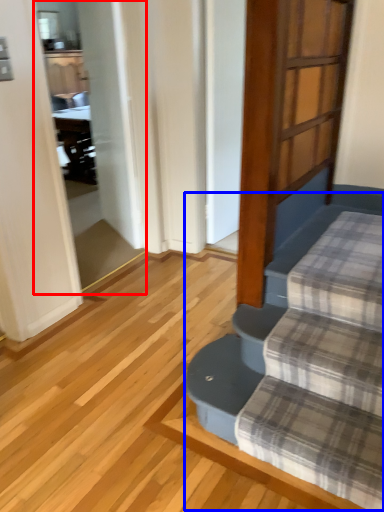
Question: Which point is further to the camera, screen door (highlighted by a red box) or stairwell (highlighted by a blue box)?

Choices:
 (A) screen door
 (B) stairwell

Answer: (A)